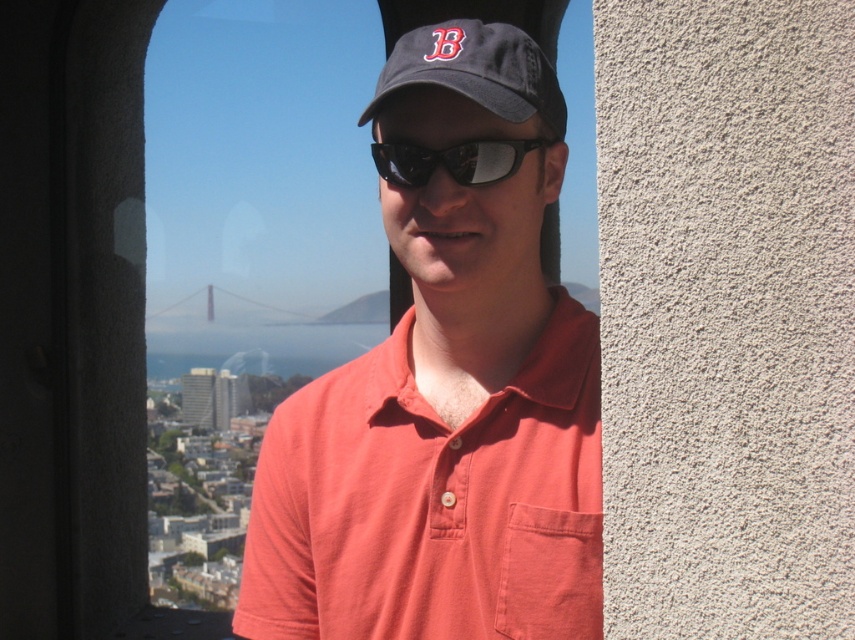
Question: Can you confirm if matte orange polo shirt at center is positioned to the left of black reflective sunglasses at center?

Choices:
 (A) no
 (B) yes

Answer: (A)

Question: Which point is closer to the camera?

Choices:
 (A) black reflective sunglasses at center
 (B) dark gray fabric cap at center
 (C) matte orange polo shirt at center

Answer: (C)

Question: Which of the following is the closest to the observer?

Choices:
 (A) (279, 632)
 (B) (407, 172)

Answer: (A)

Question: Is dark gray fabric cap at center closer to camera compared to black reflective sunglasses at center?

Choices:
 (A) no
 (B) yes

Answer: (B)

Question: Does dark gray fabric cap at center have a greater width compared to black reflective sunglasses at center?

Choices:
 (A) no
 (B) yes

Answer: (B)

Question: Considering the real-world distances, which object is farthest from the dark gray fabric cap at center?

Choices:
 (A) black reflective sunglasses at center
 (B) matte orange polo shirt at center

Answer: (B)